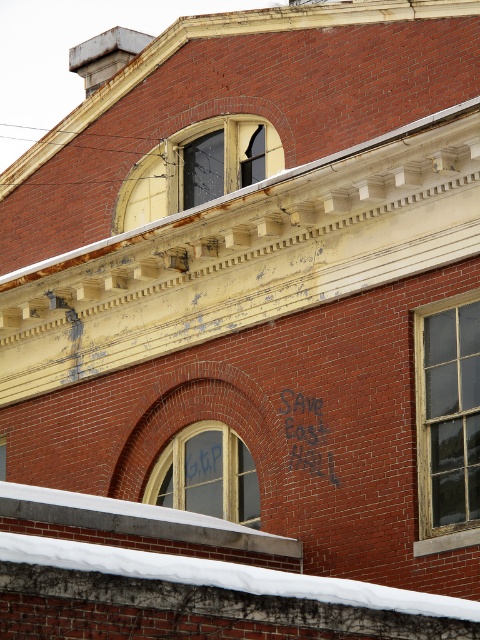
Question: Can you confirm if wooden window at right is smaller than dark glass window at upper center?

Choices:
 (A) yes
 (B) no

Answer: (B)

Question: Does dark glass window at upper center appear over wooden window at center?

Choices:
 (A) yes
 (B) no

Answer: (A)

Question: Which of the following is the closest to the observer?

Choices:
 (A) wooden window at center
 (B) dark glass window at upper center
 (C) wooden window at right

Answer: (C)

Question: Is wooden window at right to the right of dark glass window at upper center from the viewer's perspective?

Choices:
 (A) no
 (B) yes

Answer: (B)

Question: Which object is positioned closest to the dark glass window at upper center?

Choices:
 (A) wooden window at right
 (B) wooden window at center

Answer: (B)

Question: Which object is farther from the camera taking this photo?

Choices:
 (A) dark glass window at upper center
 (B) wooden window at right

Answer: (A)